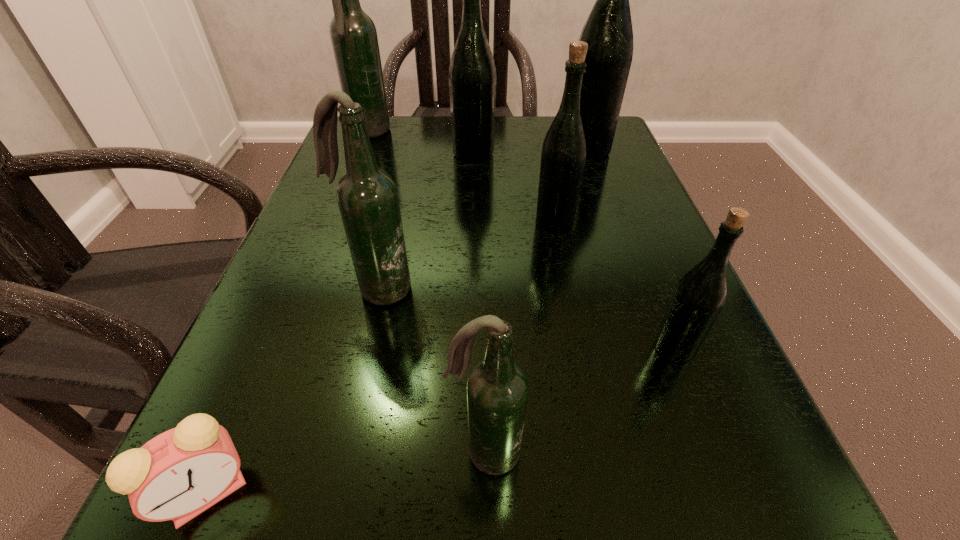
The height and width of the screenshot is (540, 960). Find the location of `free spot between the tallest beer bottle and the leftmost green beer bottle`. free spot between the tallest beer bottle and the leftmost green beer bottle is located at coordinates (530, 152).

Locate an element on the screen. The image size is (960, 540). unoccupied area between the third object from left to right and the second green beer bottle from left to right is located at coordinates pos(466,255).

The height and width of the screenshot is (540, 960). In order to click on vacant space that is in between the biggest dark beer bottle and the third beer bottle from right to left in this screenshot , I will do 462,178.

Locate an element on the screen. This screenshot has width=960, height=540. unoccupied position between the third beer bottle from right to left and the second biggest green beer bottle is located at coordinates (514, 188).

Identify which object is located as the seventh nearest to the alarm clock. Please provide its 2D coordinates. Your answer should be formatted as a tuple, i.e. [(x, y)], where the tuple contains the x and y coordinates of a point satisfying the conditions above.

[(608, 31)]

Identify which object is the fourth closest to the third object from right to left. Please provide its 2D coordinates. Your answer should be formatted as a tuple, i.e. [(x, y)], where the tuple contains the x and y coordinates of a point satisfying the conditions above.

[(698, 298)]

Locate which beer bottle ranks second in proximity to the second biggest green beer bottle. Please provide its 2D coordinates. Your answer should be formatted as a tuple, i.e. [(x, y)], where the tuple contains the x and y coordinates of a point satisfying the conditions above.

[(353, 34)]

Where is `the third closest beer bottle to the rightmost dark beer bottle`? the third closest beer bottle to the rightmost dark beer bottle is located at coordinates (563, 156).

Locate which green beer bottle ranks second in proximity to the third smallest green beer bottle. Please provide its 2D coordinates. Your answer should be formatted as a tuple, i.e. [(x, y)], where the tuple contains the x and y coordinates of a point satisfying the conditions above.

[(563, 156)]

Find the location of `green beer bottle that is the fourth closest one to the biggest dark beer bottle`. green beer bottle that is the fourth closest one to the biggest dark beer bottle is located at coordinates (698, 298).